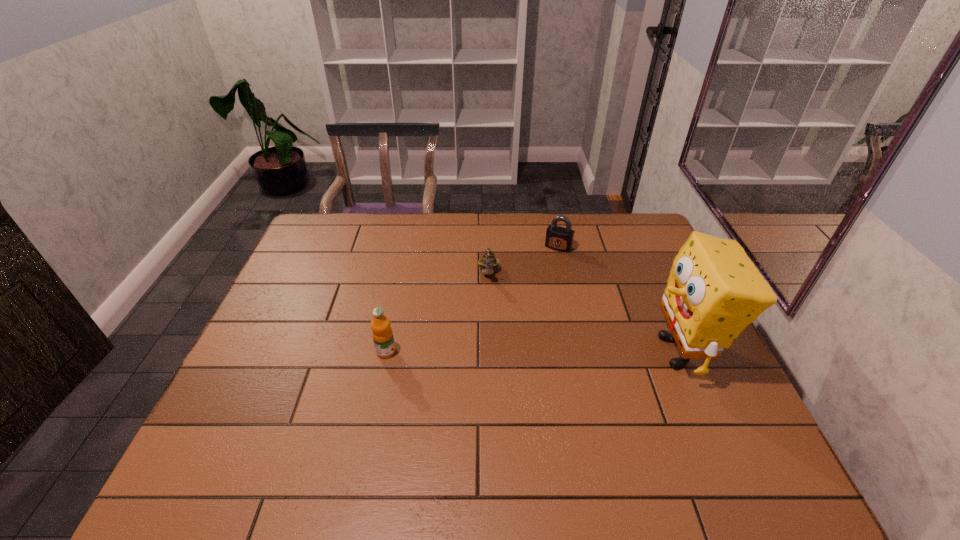
Locate an element on the screen. The height and width of the screenshot is (540, 960). free space located on the face of the tallest object is located at coordinates (499, 352).

Locate an element on the screen. vacant point located on the face of the tallest object is located at coordinates (556, 352).

Where is `free space located on the face of the second farthest object`? This screenshot has height=540, width=960. free space located on the face of the second farthest object is located at coordinates (491, 341).

I want to click on free space located on the face of the second farthest object, so click(491, 341).

This screenshot has height=540, width=960. Find the location of `vacant space located 0.330m on the face of the second farthest object`. vacant space located 0.330m on the face of the second farthest object is located at coordinates (492, 374).

Locate an element on the screen. This screenshot has width=960, height=540. blank space located 0.390m on the front of the padlock near the keyhole is located at coordinates (515, 330).

In order to click on free space located on the front of the padlock near the keyhole in this screenshot , I will do `click(540, 279)`.

This screenshot has width=960, height=540. What are the coordinates of `vacant space located 0.260m on the front of the padlock near the keyhole` in the screenshot? It's located at (530, 301).

Locate an element on the screen. The image size is (960, 540). object present at the far edge is located at coordinates (558, 238).

Where is `object located in the right edge section of the desktop`? object located in the right edge section of the desktop is located at coordinates (714, 290).